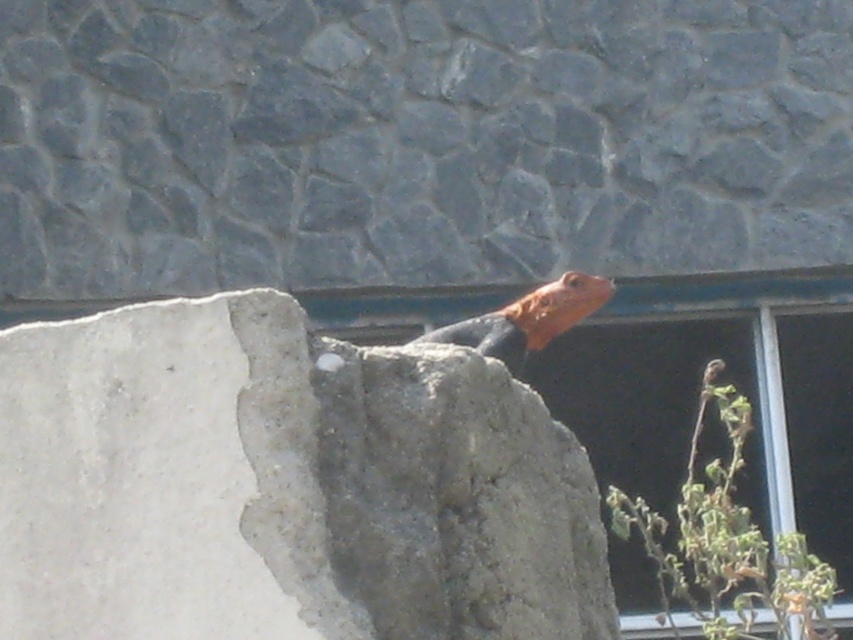
Question: Which point is closer to the camera?

Choices:
 (A) [x=595, y=300]
 (B) [x=230, y=365]

Answer: (B)

Question: Can you confirm if gray concrete rock at center is smaller than orange-brown scaly lizard at upper center?

Choices:
 (A) yes
 (B) no

Answer: (B)

Question: Which of the following is the farthest from the observer?

Choices:
 (A) coord(445,333)
 (B) coord(73,550)

Answer: (A)

Question: Which point is farther to the camera?

Choices:
 (A) (225, 532)
 (B) (583, 282)

Answer: (B)

Question: Does gray concrete rock at center appear on the right side of orange-brown scaly lizard at upper center?

Choices:
 (A) yes
 (B) no

Answer: (B)

Question: Is gray concrete rock at center positioned behind orange-brown scaly lizard at upper center?

Choices:
 (A) yes
 (B) no

Answer: (B)